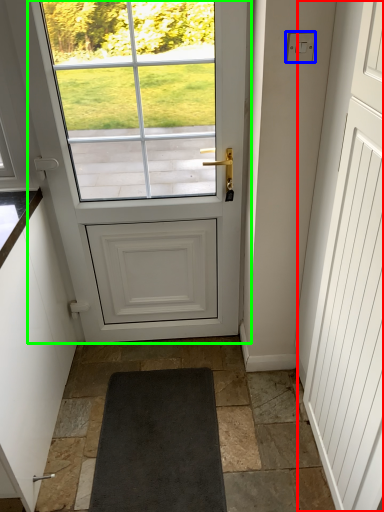
Question: Estimate the real-world distances between objects in this image. Which object is closer to screen door (highlighted by a red box), lock (highlighted by a blue box) or door (highlighted by a green box)?

Choices:
 (A) lock
 (B) door

Answer: (B)